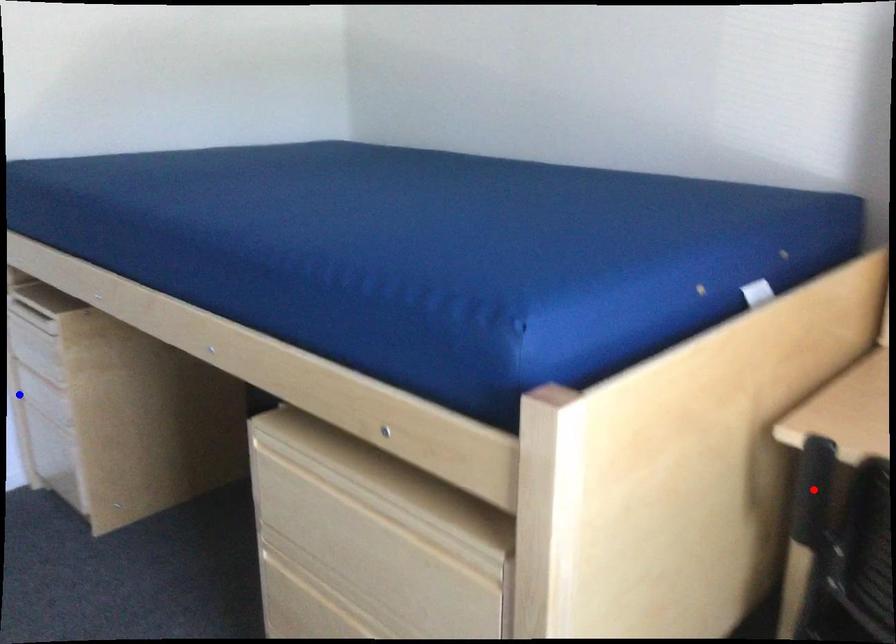
Question: In the image, two points are highlighted. Which point is nearer to the camera? Reply with the corresponding letter.

Choices:
 (A) blue point
 (B) red point

Answer: (B)